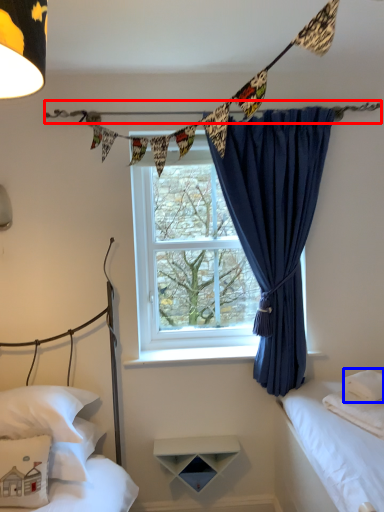
Question: Which point is further to the camera, clothesline (highlighted by a red box) or pillow (highlighted by a blue box)?

Choices:
 (A) clothesline
 (B) pillow

Answer: (A)